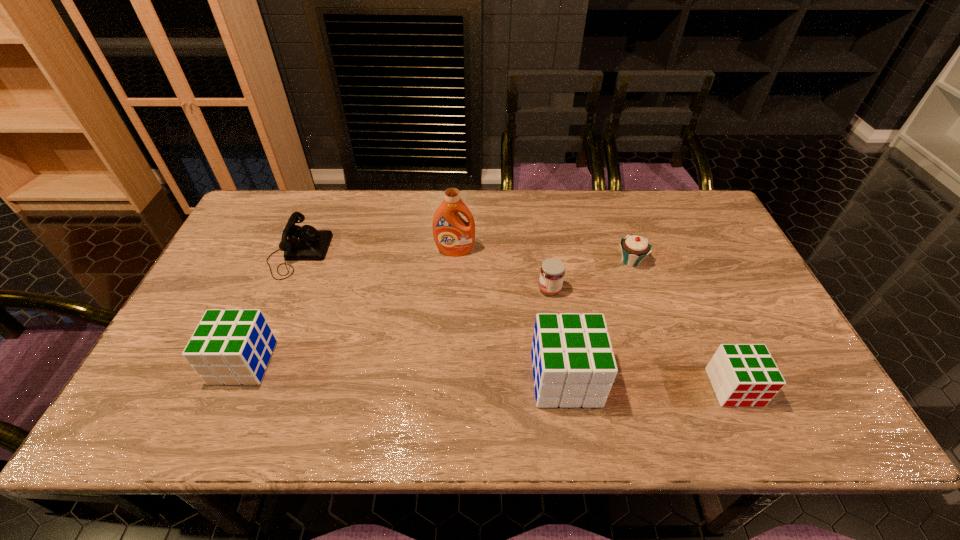
Where is `object that can be found as the sixth closest to the second cube from right to left`? object that can be found as the sixth closest to the second cube from right to left is located at coordinates (305, 243).

Locate an element on the screen. object that is the third closest one to the tallest cube is located at coordinates (635, 248).

Find the location of a particular element. cube identified as the second closest to the second cube from left to right is located at coordinates (233, 346).

Identify which cube is the second closest to the third tallest object. Please provide its 2D coordinates. Your answer should be formatted as a tuple, i.e. [(x, y)], where the tuple contains the x and y coordinates of a point satisfying the conditions above.

[(742, 375)]

You are a GUI agent. You are given a task and a screenshot of the screen. Output one action in this format:
    pyautogui.click(x=<x>, y=<y>)
    Task: Click on the free location that satisfies the following two spatial constraints: 1. on the front-facing side of the detergent; 2. on the red face of the third tallest object
    The width and height of the screenshot is (960, 540).
    Given the screenshot: What is the action you would take?
    pyautogui.click(x=448, y=362)

This screenshot has height=540, width=960. In order to click on vacant space that satisfies the following two spatial constraints: 1. on the front-facing side of the jam; 2. on the right side of the tallest object in this screenshot , I will do `click(453, 289)`.

This screenshot has height=540, width=960. Find the location of `vacant space that satisfies the following two spatial constraints: 1. on the front side of the jam; 2. on the red face of the leftmost cube`. vacant space that satisfies the following two spatial constraints: 1. on the front side of the jam; 2. on the red face of the leftmost cube is located at coordinates (561, 362).

Find the location of a particular element. The height and width of the screenshot is (540, 960). vacant point that satisfies the following two spatial constraints: 1. on the front side of the cupcake; 2. on the red face of the second cube from right to left is located at coordinates (671, 379).

The height and width of the screenshot is (540, 960). In order to click on free space that satisfies the following two spatial constraints: 1. on the front-facing side of the detergent; 2. on the red face of the leftmost cube in this screenshot , I will do `click(448, 362)`.